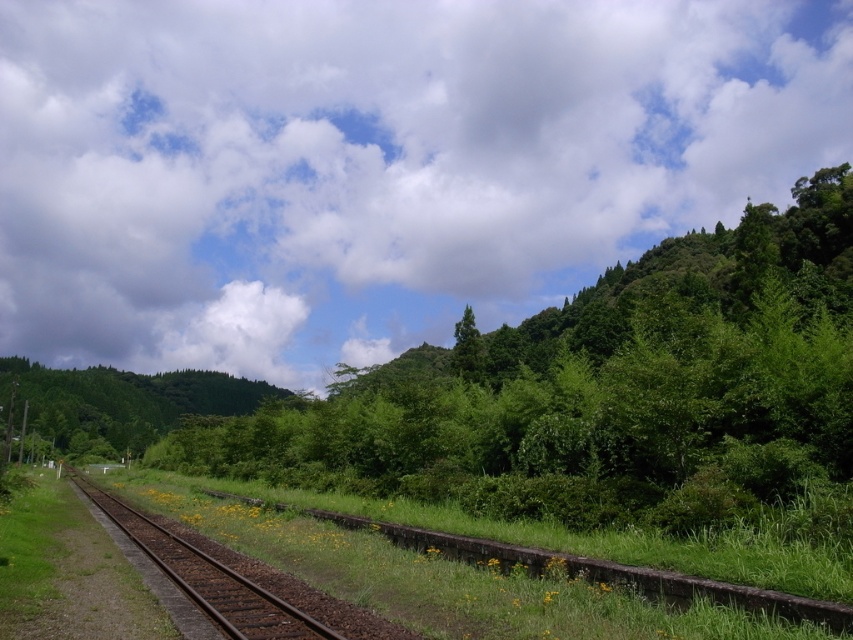
Can you confirm if green leafy tree at upper center is taller than green leafy tree at center?

Indeed, green leafy tree at upper center has a greater height compared to green leafy tree at center.

Is point (815, 410) farther from viewer compared to point (465, 342)?

No.

At what (x,y) coordinates should I click in order to perform the action: click on green leafy tree at upper center. Please return your answer as a coordinate pair (x, y). This screenshot has width=853, height=640. Looking at the image, I should click on (601, 392).

How much distance is there between brown rusted metal track at center and brown metal train track at lower left?

brown rusted metal track at center is 10.87 meters from brown metal train track at lower left.

Which is in front, point (819, 605) or point (132, 522)?

Point (819, 605) is more forward.

This screenshot has height=640, width=853. Find the location of `brown rusted metal track at center`. brown rusted metal track at center is located at coordinates (582, 566).

Between brown metal train track at lower left and green leafy tree at center, which one has less height?

brown metal train track at lower left is shorter.

Is brown metal train track at lower left shorter than green leafy tree at center?

Yes, brown metal train track at lower left is shorter than green leafy tree at center.

This screenshot has height=640, width=853. What do you see at coordinates (207, 579) in the screenshot? I see `brown metal train track at lower left` at bounding box center [207, 579].

Where is `brown metal train track at lower left`? This screenshot has height=640, width=853. brown metal train track at lower left is located at coordinates (207, 579).